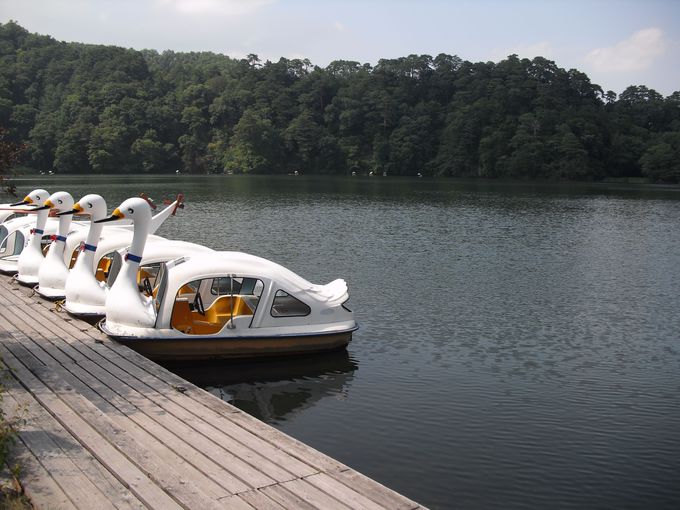
The image size is (680, 510). Find the location of `window`. window is located at coordinates (286, 308), (221, 287), (256, 286).